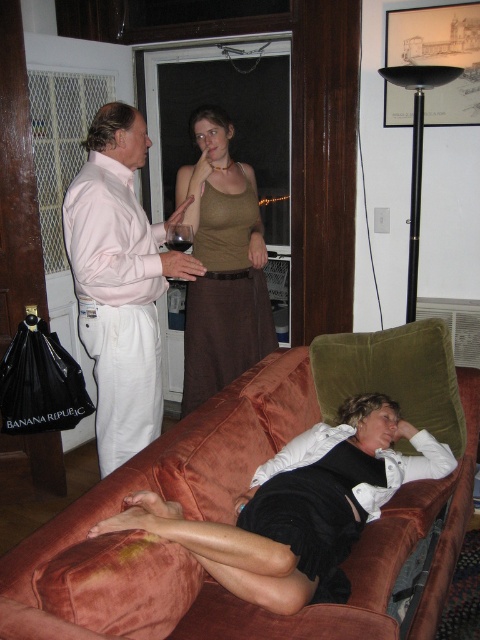
Question: Which object is closer to the camera taking this photo?

Choices:
 (A) matte green tank top at upper center
 (B) white cotton pants at left

Answer: (B)

Question: Which point is closer to the camera?

Choices:
 (A) (108, 298)
 (B) (238, 244)
 (C) (354, 579)

Answer: (C)

Question: Which point appears closest to the camera in this image?

Choices:
 (A) (233, 294)
 (B) (388, 529)

Answer: (B)

Question: Can you confirm if white cotton pants at left is wider than matte green tank top at upper center?

Choices:
 (A) no
 (B) yes

Answer: (B)

Question: Is white cotton pants at left thinner than matte green tank top at upper center?

Choices:
 (A) yes
 (B) no

Answer: (B)

Question: Is velvet brown couch at lower center to the right of white cotton pants at left from the viewer's perspective?

Choices:
 (A) no
 (B) yes

Answer: (B)